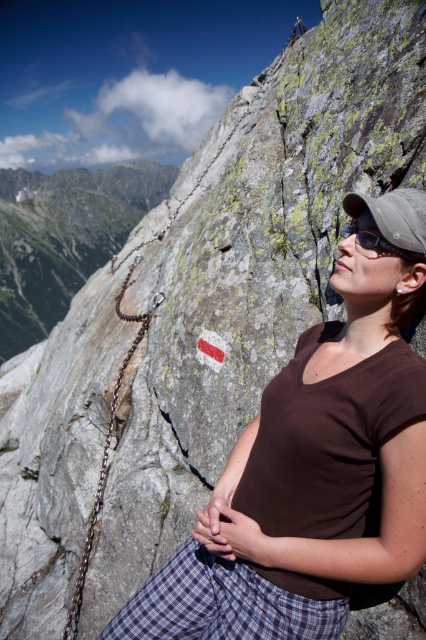
Question: Is metallic chain at upper left below black matte goggles at upper right?

Choices:
 (A) no
 (B) yes

Answer: (A)

Question: Does brown cotton shirt at center have a larger size compared to gray fabric baseball cap at upper right?

Choices:
 (A) yes
 (B) no

Answer: (A)

Question: Is brown cotton shirt at center smaller than gray fabric baseball cap at upper right?

Choices:
 (A) no
 (B) yes

Answer: (A)

Question: Estimate the real-world distances between objects in this image. Which object is farther from the black matte goggles at upper right?

Choices:
 (A) gray fabric baseball cap at upper right
 (B) metallic chain at upper left

Answer: (B)

Question: Among these points, which one is farthest from the camera?

Choices:
 (A) (203, 520)
 (B) (411, 237)
 (C) (391, 321)
 (D) (351, 227)

Answer: (D)

Question: Which of these objects is positioned closest to the black matte goggles at upper right?

Choices:
 (A) gray fabric baseball cap at upper right
 (B) metallic chain at upper left
 (C) brown matte shirt at center
 (D) brown cotton shirt at center

Answer: (A)